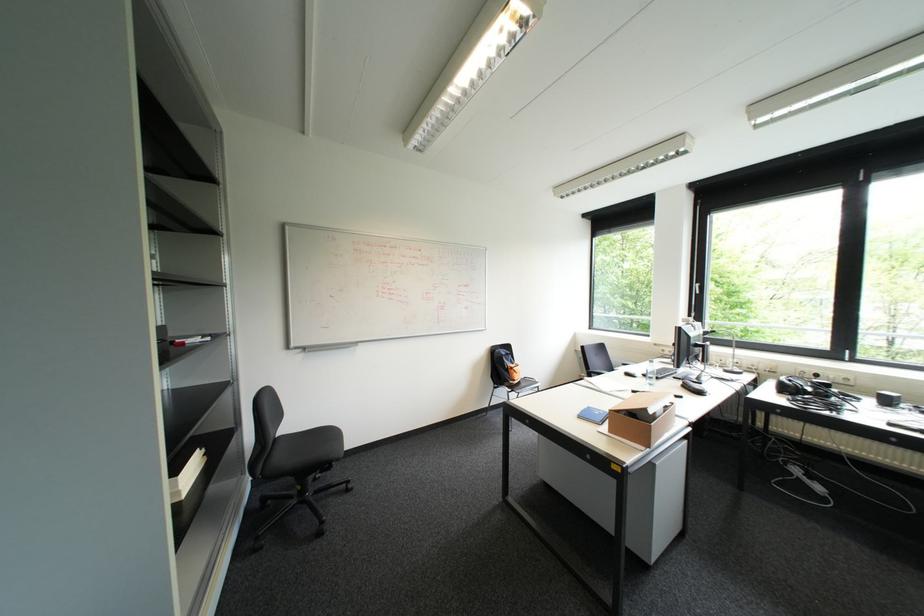
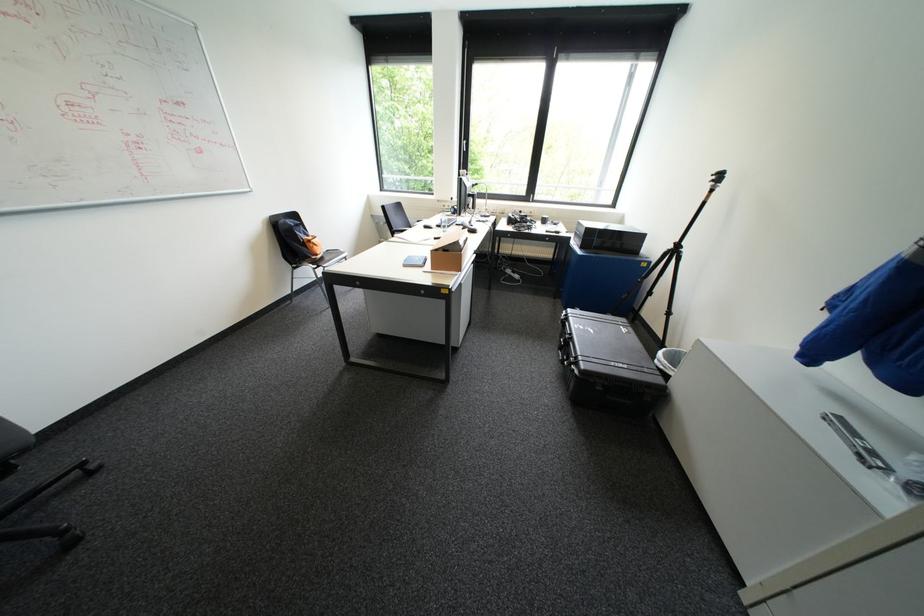
The point at (515, 363) is marked in the first image. Where is the corresponding point in the second image?

(310, 237)